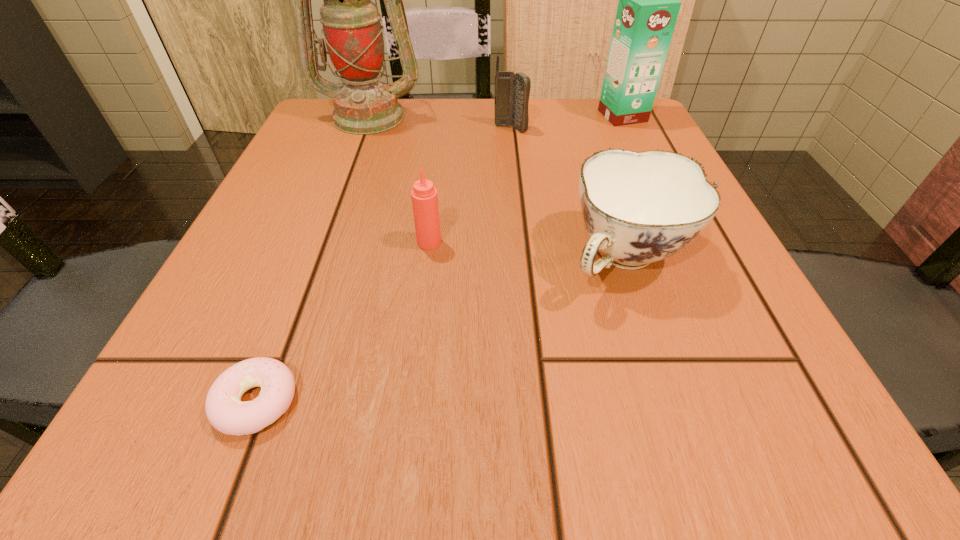
Select which object appears as the closest to the cellular telephone. Please provide its 2D coordinates. Your answer should be formatted as a tuple, i.e. [(x, y)], where the tuple contains the x and y coordinates of a point satisfying the conditions above.

[(353, 34)]

At what (x,y) coordinates should I click in order to perform the action: click on vacant space that satisfies the following two spatial constraints: 1. on the keyboard of the chinaware; 2. on the right side of the cellular telephone. Please return your answer as a coordinate pair (x, y). Looking at the image, I should click on (523, 258).

The width and height of the screenshot is (960, 540). What are the coordinates of `free point that satisfies the following two spatial constraints: 1. on the front side of the third object from left to right; 2. on the left side of the chinaware` in the screenshot? It's located at (427, 258).

The height and width of the screenshot is (540, 960). Find the location of `vacant space that satisfies the following two spatial constraints: 1. on the keyboard of the fourth object from left to right; 2. on the left side of the chinaware`. vacant space that satisfies the following two spatial constraints: 1. on the keyboard of the fourth object from left to right; 2. on the left side of the chinaware is located at coordinates (523, 258).

This screenshot has width=960, height=540. What are the coordinates of `free space that satisfies the following two spatial constraints: 1. on the back side of the Tabasco sauce; 2. on the right side of the nearest object` in the screenshot? It's located at (318, 242).